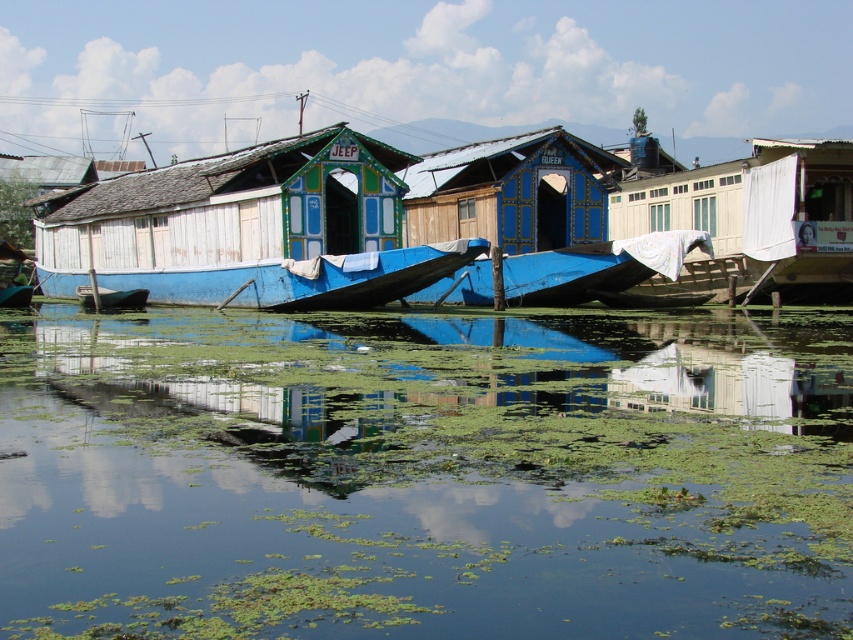
Does blue wooden hut at center lie behind green plastic boat at center?

That is False.

Between point (431, 179) and point (125, 304), which one is positioned in front?

Point (125, 304)

Identify the location of blue wooden hut at center. (511, 192).

Is point (773, 392) closer to viewer compared to point (439, 163)?

Yes, point (773, 392) is closer to viewer.

Is the position of green algae water at center more distant than that of blue wooden hut at center?

No, it is in front of blue wooden hut at center.

I want to click on green algae water at center, so 424,474.

In the scene shown: Who is more distant from viewer, (202, 298) or (654, 252)?

The point (202, 298) is more distant.

Image resolution: width=853 pixels, height=640 pixels. In order to click on white wooden boat at center in this screenshot , I will do click(x=302, y=278).